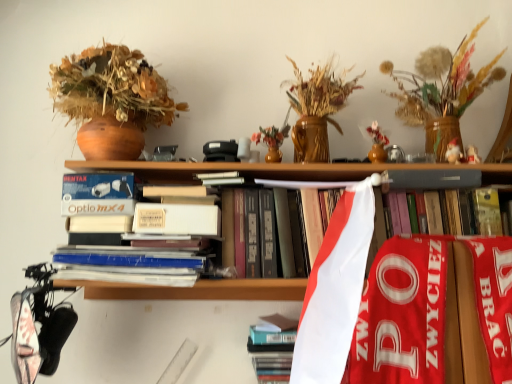
Question: Is hardcover book at center, which ranks as the 2th book in top-to-bottom order, facing away from matte brown vase at upper left?

Choices:
 (A) no
 (B) yes

Answer: (A)

Question: Does hardcover book at center, marked as the 1th book in a bottom-to-top arrangement, have a smaller size compared to matte brown vase at upper left?

Choices:
 (A) no
 (B) yes

Answer: (B)

Question: Is hardcover book at center, which ranks as the 2th book in top-to-bottom order, taller than matte brown vase at upper left?

Choices:
 (A) yes
 (B) no

Answer: (B)

Question: Does hardcover book at center, which ranks as the 2th book in top-to-bottom order, have a greater width compared to matte brown vase at upper left?

Choices:
 (A) no
 (B) yes

Answer: (A)

Question: Considering the relative sizes of hardcover book at center, which ranks as the 2th book in top-to-bottom order, and matte brown vase at upper left in the image provided, is hardcover book at center, which ranks as the 2th book in top-to-bottom order, thinner than matte brown vase at upper left?

Choices:
 (A) no
 (B) yes

Answer: (B)

Question: Is wooden vase with dried flowers at upper right taller or shorter than matte brown vase at upper left?

Choices:
 (A) short
 (B) tall

Answer: (A)

Question: Is point (433, 79) closer or farther from the camera than point (75, 114)?

Choices:
 (A) closer
 (B) farther

Answer: (B)

Question: Relative to matte brown vase at upper left, is wooden vase with dried flowers at upper right in front or behind?

Choices:
 (A) front
 (B) behind

Answer: (A)

Question: Is wooden vase with dried flowers at upper right to the left or to the right of matte brown vase at upper left in the image?

Choices:
 (A) right
 (B) left

Answer: (A)

Question: From their relative heights in the image, would you say matte brown vase at upper left is taller or shorter than hardcover book at center, acting as the second book starting from the bottom?

Choices:
 (A) tall
 (B) short

Answer: (A)

Question: Considering the positions of matte brown vase at upper left and hardcover book at center, acting as the second book starting from the bottom, in the image, is matte brown vase at upper left wider or thinner than hardcover book at center, acting as the second book starting from the bottom,?

Choices:
 (A) wide
 (B) thin

Answer: (A)

Question: From the image's perspective, is matte brown vase at upper left above or below hardcover book at center, which is counted as the 1th book, starting from the top?

Choices:
 (A) below
 (B) above

Answer: (B)

Question: Is matte brown vase at upper left situated inside hardcover book at center, acting as the second book starting from the bottom, or outside?

Choices:
 (A) inside
 (B) outside

Answer: (B)

Question: Considering the positions of point (275, 344) and point (164, 89), is point (275, 344) closer or farther from the camera than point (164, 89)?

Choices:
 (A) closer
 (B) farther

Answer: (A)

Question: From the image's perspective, is hardcover book at center, marked as the 1th book in a bottom-to-top arrangement, positioned above or below matte brown vase at upper left?

Choices:
 (A) above
 (B) below

Answer: (B)